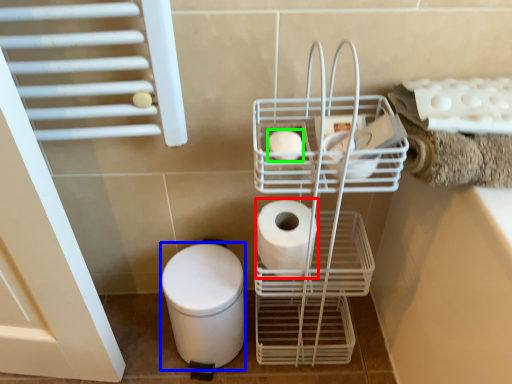
Question: Considering the real-world distances, which object is farthest from toilet paper (highlighted by a red box)? bidet (highlighted by a blue box) or toilet paper (highlighted by a green box)?

Choices:
 (A) bidet
 (B) toilet paper

Answer: (A)